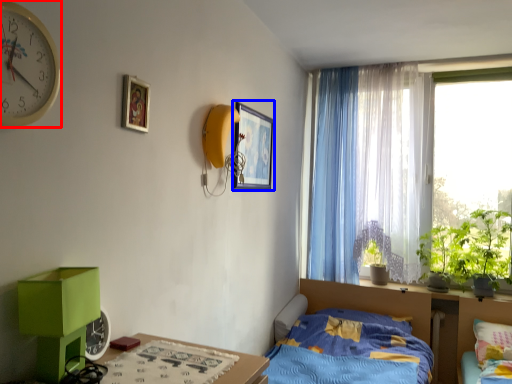
Question: Among these objects, which one is farthest to the camera, clock (highlighted by a red box) or picture frame (highlighted by a blue box)?

Choices:
 (A) clock
 (B) picture frame

Answer: (B)